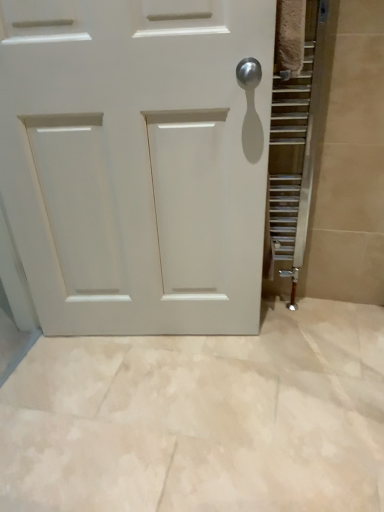
Where is `free space on the front side of white matte door at center`? free space on the front side of white matte door at center is located at coordinates (161, 418).